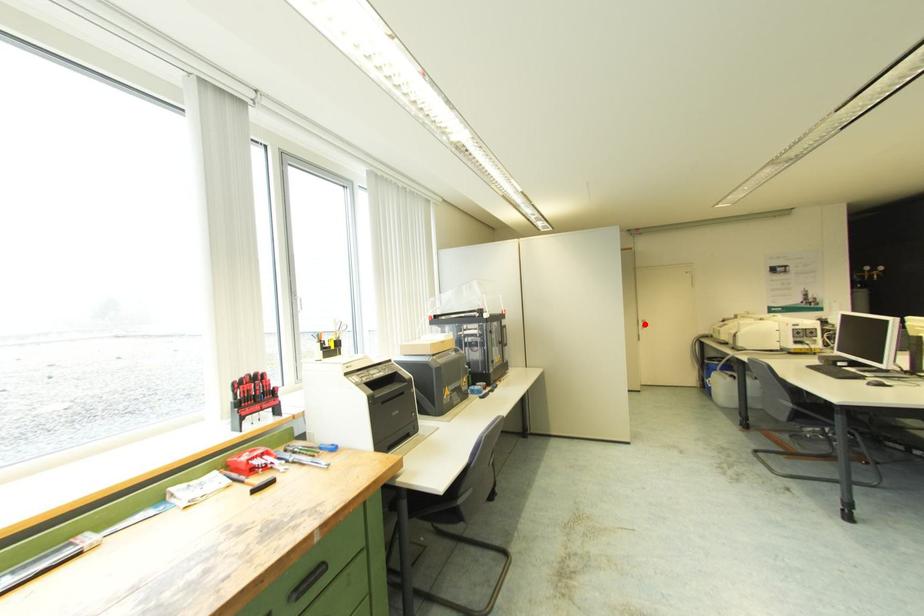
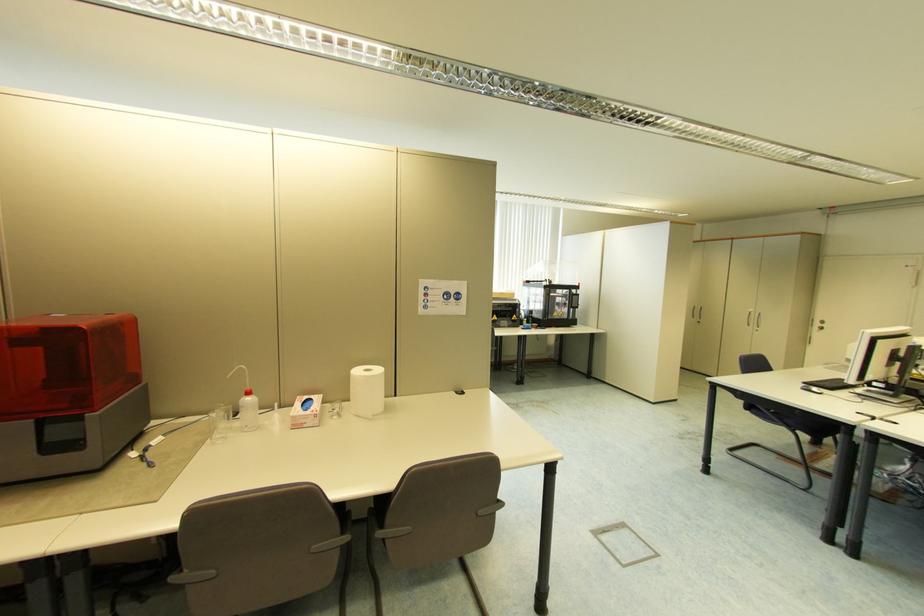
Find the pixel in the second image that matches the highlighted location in the first image.

(821, 325)